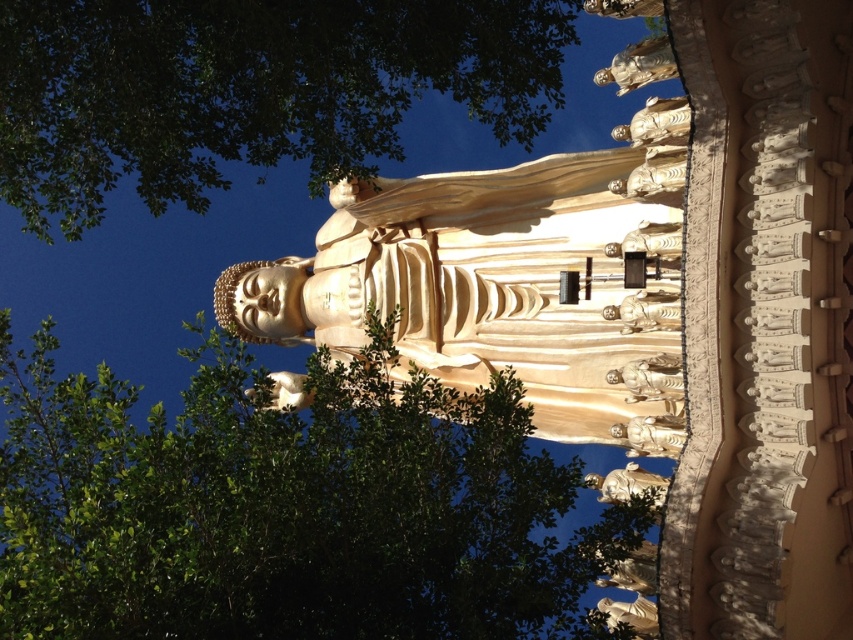
Question: Is gold textured statue at center thinner than gold polished statue at center?

Choices:
 (A) no
 (B) yes

Answer: (A)

Question: Does green leafy tree at upper left appear under gold textured statue at center?

Choices:
 (A) no
 (B) yes

Answer: (A)

Question: Which is nearer to the gold textured statue at center?

Choices:
 (A) gold polished statue at upper right
 (B) gold polished statue at lower right
 (C) gold polished statue at upper center

Answer: (A)

Question: Observing the image, what is the correct spatial positioning of green leafy tree at upper left in reference to matte gold statue at center?

Choices:
 (A) right
 (B) left

Answer: (B)

Question: Which of the following is the farthest from the observer?

Choices:
 (A) (608, 317)
 (B) (618, 74)
 (C) (666, 182)
 (D) (386, 12)

Answer: (B)

Question: Which point appears farthest from the camera in this image?

Choices:
 (A) (656, 109)
 (B) (633, 400)
 (C) (247, 140)
 (D) (596, 476)

Answer: (D)